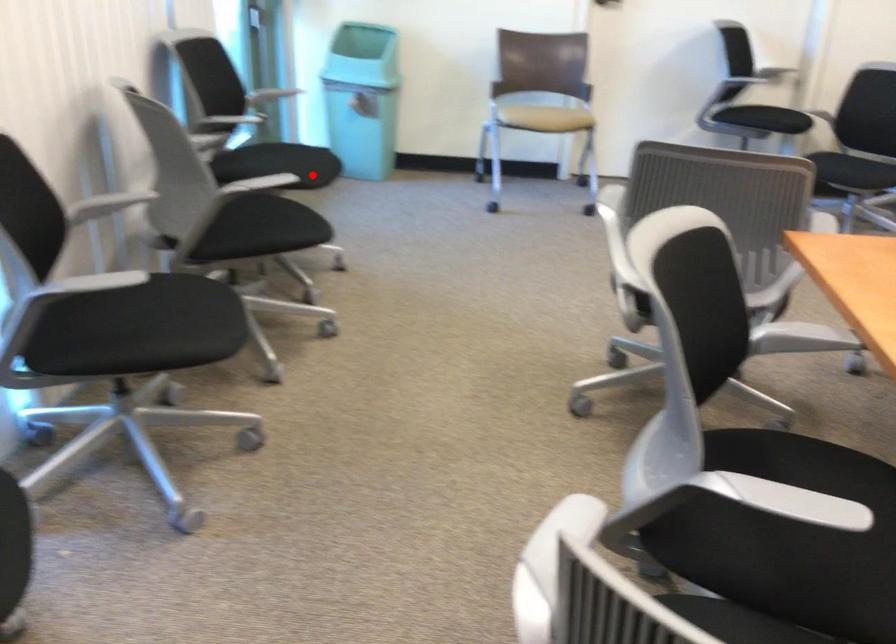
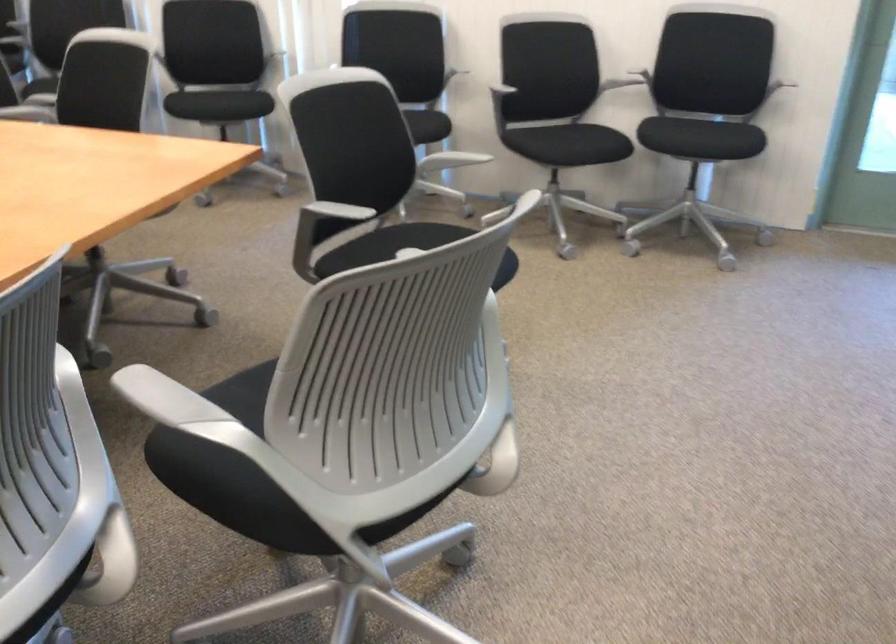
In the second image, find the point that corresponds to the highlighted location in the first image.

(701, 138)